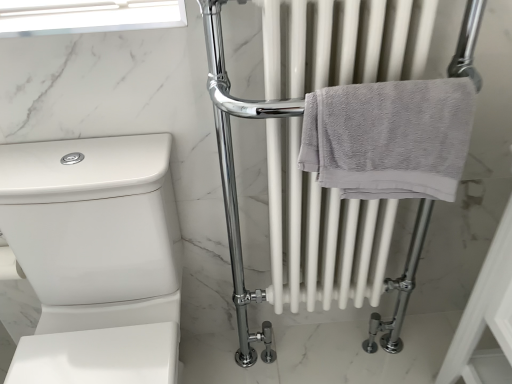
Question: Is transparent glass window screen at upper left positioned in front of white glossy toilet at lower left?

Choices:
 (A) no
 (B) yes

Answer: (A)

Question: Does transparent glass window screen at upper left have a greater height compared to white glossy toilet at lower left?

Choices:
 (A) no
 (B) yes

Answer: (A)

Question: Is transparent glass window screen at upper left not close to white glossy toilet at lower left?

Choices:
 (A) yes
 (B) no

Answer: (B)

Question: Does transparent glass window screen at upper left appear on the left side of white glossy toilet at lower left?

Choices:
 (A) no
 (B) yes

Answer: (B)

Question: Considering the relative sizes of transparent glass window screen at upper left and white glossy toilet at lower left in the image provided, is transparent glass window screen at upper left bigger than white glossy toilet at lower left?

Choices:
 (A) no
 (B) yes

Answer: (A)

Question: Does point (413, 139) appear closer or farther from the camera than point (121, 266)?

Choices:
 (A) farther
 (B) closer

Answer: (B)

Question: Considering the positions of gray cotton towel at center right and white glossy toilet at lower left in the image, is gray cotton towel at center right taller or shorter than white glossy toilet at lower left?

Choices:
 (A) tall
 (B) short

Answer: (B)

Question: Is gray cotton towel at center right bigger or smaller than white glossy toilet at lower left?

Choices:
 (A) small
 (B) big

Answer: (A)

Question: Is gray cotton towel at center right wider or thinner than white glossy toilet at lower left?

Choices:
 (A) thin
 (B) wide

Answer: (A)

Question: From their relative heights in the image, would you say white glossy toilet at lower left is taller or shorter than transparent glass window screen at upper left?

Choices:
 (A) short
 (B) tall

Answer: (B)

Question: Visually, is white glossy toilet at lower left positioned to the left or to the right of transparent glass window screen at upper left?

Choices:
 (A) left
 (B) right

Answer: (B)

Question: Is white glossy toilet at lower left wider or thinner than transparent glass window screen at upper left?

Choices:
 (A) wide
 (B) thin

Answer: (A)

Question: Is white glossy toilet at lower left inside the boundaries of transparent glass window screen at upper left, or outside?

Choices:
 (A) inside
 (B) outside

Answer: (B)

Question: Considering the relative positions of transparent glass window screen at upper left and gray cotton towel at center right in the image provided, is transparent glass window screen at upper left to the left or to the right of gray cotton towel at center right?

Choices:
 (A) left
 (B) right

Answer: (A)

Question: Would you say transparent glass window screen at upper left is inside or outside gray cotton towel at center right?

Choices:
 (A) inside
 (B) outside

Answer: (B)